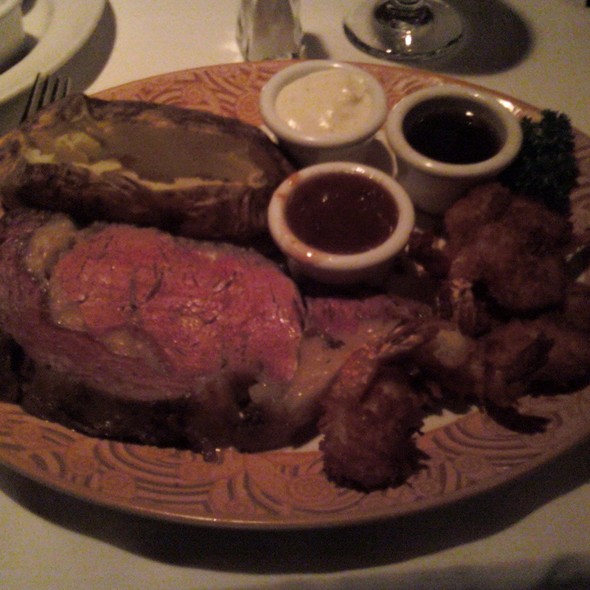
Find the location of a particular element. glass is located at coordinates (241, 42), (418, 44).